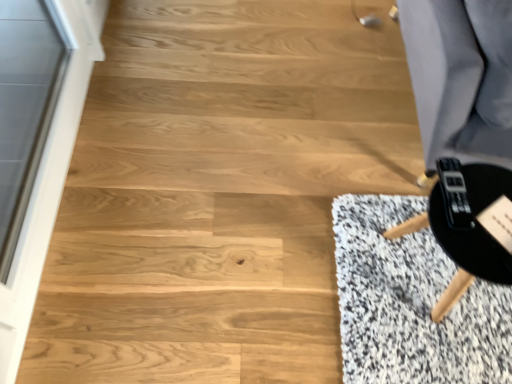
The image size is (512, 384). I want to click on vacant area on the back side of transparent glass screen door at left, so click(147, 91).